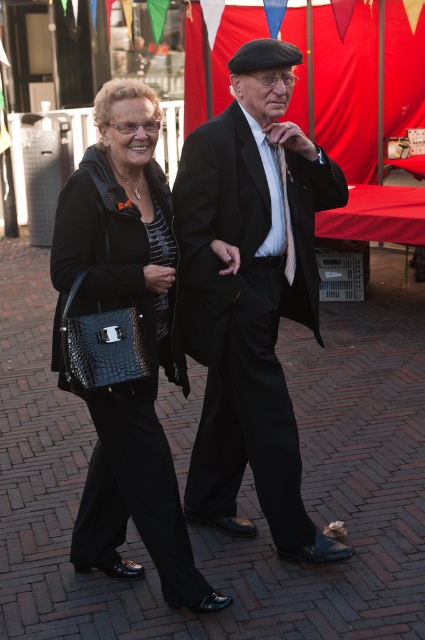
Question: Among these objects, which one is nearest to the camera?

Choices:
 (A) black crocodile-patterned handbag at center-left
 (B) brick pavement at center
 (C) black matte suit at center

Answer: (A)

Question: Can you confirm if black matte suit at center is smaller than black crocodile-patterned handbag at center-left?

Choices:
 (A) yes
 (B) no

Answer: (B)

Question: Which is nearer to the black matte suit at center?

Choices:
 (A) striped silk tie at center
 (B) black crocodile-patterned handbag at center-left

Answer: (B)

Question: Estimate the real-world distances between objects in this image. Which object is farther from the striped silk tie at center?

Choices:
 (A) brick pavement at center
 (B) black matte suit at center
 (C) black crocodile-patterned handbag at center-left

Answer: (A)

Question: Can you confirm if black matte suit at center is positioned below black crocodile-patterned handbag at center-left?

Choices:
 (A) no
 (B) yes

Answer: (A)

Question: From the image, what is the correct spatial relationship of black matte suit at center in relation to black crocodile-patterned handbag at center-left?

Choices:
 (A) above
 (B) below

Answer: (A)